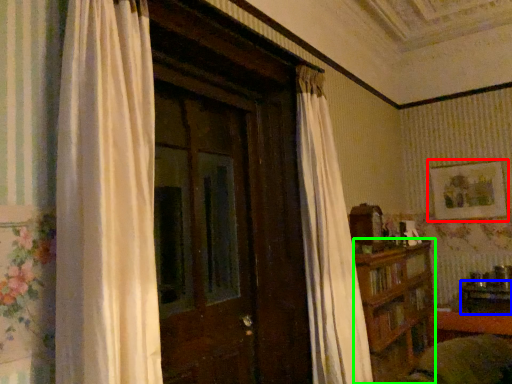
Question: Considering the real-world distances, which object is farthest from picture frame (highlighted by a red box)? table (highlighted by a blue box) or furniture (highlighted by a green box)?

Choices:
 (A) table
 (B) furniture

Answer: (B)